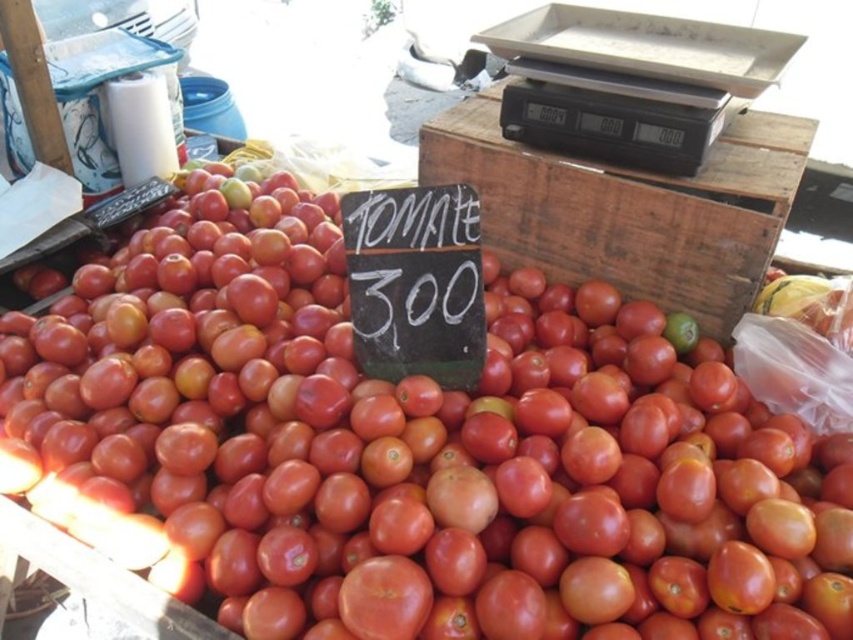
You are a customer at the market stall. You see the shiny red tomato at center and the wooden crate at center. Which object is positioned more to the left?

The shiny red tomato at center is positioned more to the left than the wooden crate at center.